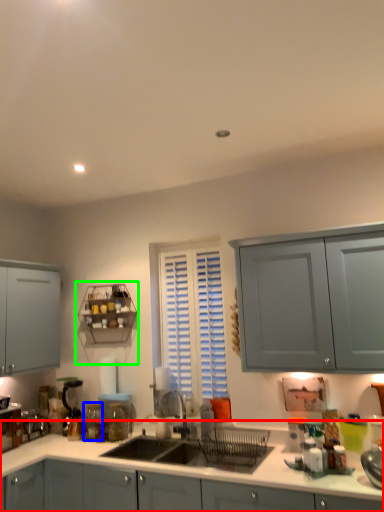
Question: Which object is positioned closest to cabinetry (highlighted by a red box)? Select from glass jar (highlighted by a blue box) and shelf (highlighted by a green box).

Choices:
 (A) glass jar
 (B) shelf

Answer: (A)